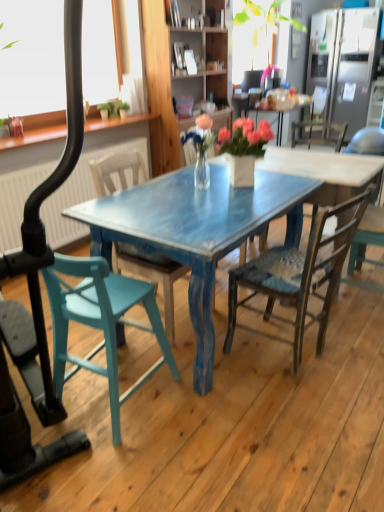
Question: From a real-world perspective, is rustic wood chair at center, which is the 2th chair from right to left, physically located above or below white matte window screen at upper left?

Choices:
 (A) above
 (B) below

Answer: (B)

Question: Considering the relative positions of rustic wood chair at center, the third chair positioned from the left, and white matte window screen at upper left in the image provided, is rustic wood chair at center, the third chair positioned from the left, to the left or to the right of white matte window screen at upper left?

Choices:
 (A) right
 (B) left

Answer: (A)

Question: Which is nearer to the clear glass vase at center?

Choices:
 (A) teal painted wood chair at left, which is the fourth chair from right to left
 (B) teal painted wood chair at center, positioned as the second chair in left-to-right order
 (C) white matte window screen at upper left
 (D) wooden cabinet at center
 (E) satin silver refrigerator at upper right

Answer: (B)

Question: Estimate the real-world distances between objects in this image. Which object is closer to the rustic wood chair at center, which is the 2th chair from right to left?

Choices:
 (A) wooden cabinet at center
 (B) teal painted wood chair at center, the third chair positioned from the right
 (C) satin silver refrigerator at upper right
 (D) wooden chair at right, which appears as the fourth chair when viewed from the left
 (E) teal painted wood chair at left, which is the fourth chair from right to left

Answer: (B)